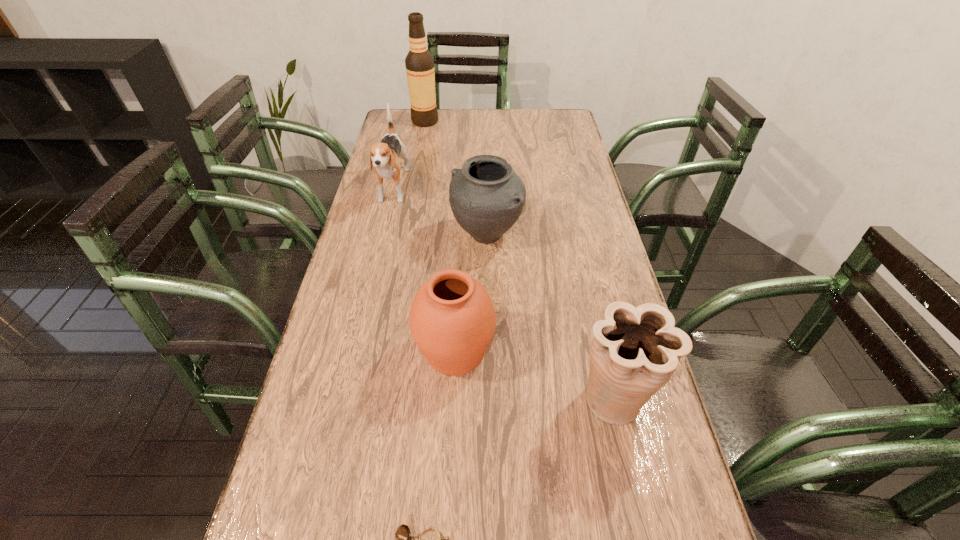
The image size is (960, 540). In order to click on alcohol that is at the left edge in this screenshot , I will do `click(419, 63)`.

Find the location of a particular element. The width and height of the screenshot is (960, 540). puppy that is at the left edge is located at coordinates (384, 157).

Locate an element on the screen. object at the right edge is located at coordinates (635, 350).

Where is `object that is at the far left corner`? object that is at the far left corner is located at coordinates (419, 63).

The image size is (960, 540). In order to click on vacant space at the far edge of the desktop in this screenshot , I will do `click(506, 120)`.

In the image, there is a desktop. Where is `vacant region at the right edge`? vacant region at the right edge is located at coordinates (549, 150).

This screenshot has height=540, width=960. What are the coordinates of `vacant area that lies between the rightmost urn and the tallest object` in the screenshot? It's located at (519, 260).

Image resolution: width=960 pixels, height=540 pixels. What are the coordinates of `free space between the tallest object and the puppy` in the screenshot? It's located at (409, 156).

Locate an element on the screen. vacant point located between the farthest urn and the rightmost object is located at coordinates (550, 317).

Find the location of `vacant area that lies between the puppy and the rightmost object`. vacant area that lies between the puppy and the rightmost object is located at coordinates (504, 294).